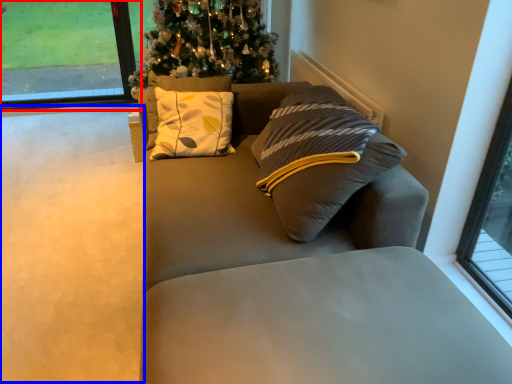
Question: Among these objects, which one is farthest to the camera, window (highlighted by a red box) or golf course (highlighted by a blue box)?

Choices:
 (A) window
 (B) golf course

Answer: (A)